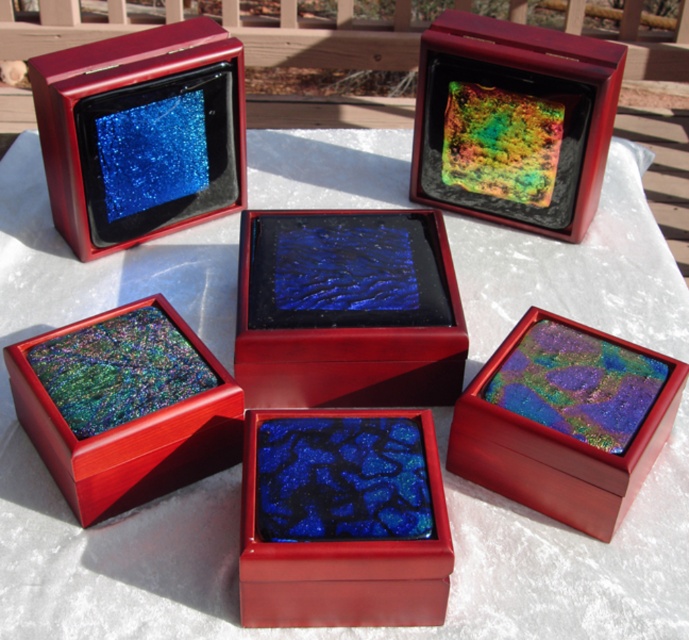
Identify the location of glossy blue glass at center. (347, 308).

At what (x,y) coordinates should I click in order to perform the action: click on glossy blue glass at center. Please return your answer as a coordinate pair (x, y). Looking at the image, I should click on (347, 308).

Between glossy blue stone at center and matte black box at upper left, which one appears on the left side from the viewer's perspective?

matte black box at upper left is more to the left.

Is glossy blue stone at center bigger than matte black box at upper left?

No.

Measure the distance between glossy blue stone at center and camera.

glossy blue stone at center is 62.97 centimeters from camera.

Find the location of a particular element. This screenshot has width=689, height=640. glossy blue stone at center is located at coordinates (342, 518).

Can you confirm if matte black box at upper left is positioned below multicolored glass mosaic at upper center?

Yes.

Does matte black box at upper left have a greater height compared to multicolored glass mosaic at upper center?

Yes.

Locate an element on the screen. Image resolution: width=689 pixels, height=640 pixels. matte black box at upper left is located at coordinates (141, 132).